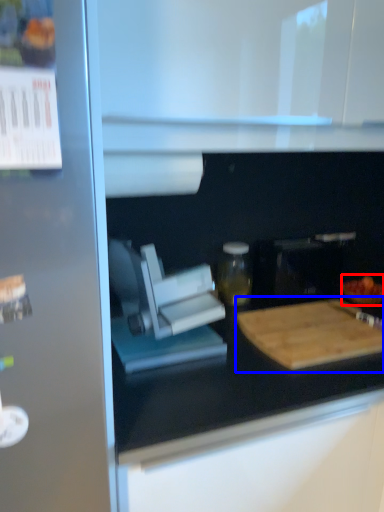
Question: Which of the following is the farthest to the observer, food (highlighted by a red box) or cutting board (highlighted by a blue box)?

Choices:
 (A) food
 (B) cutting board

Answer: (A)